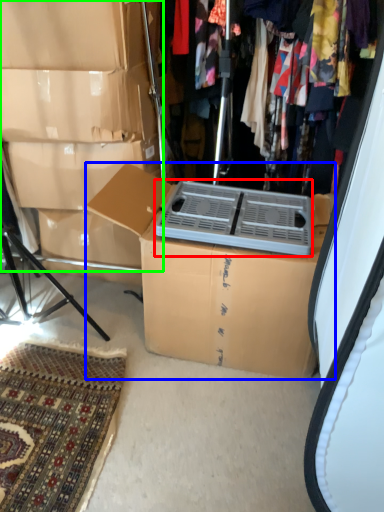
Question: Considering the real-world distances, which object is farthest from appliance (highlighted by a red box)? box (highlighted by a blue box) or storage box (highlighted by a green box)?

Choices:
 (A) box
 (B) storage box

Answer: (B)